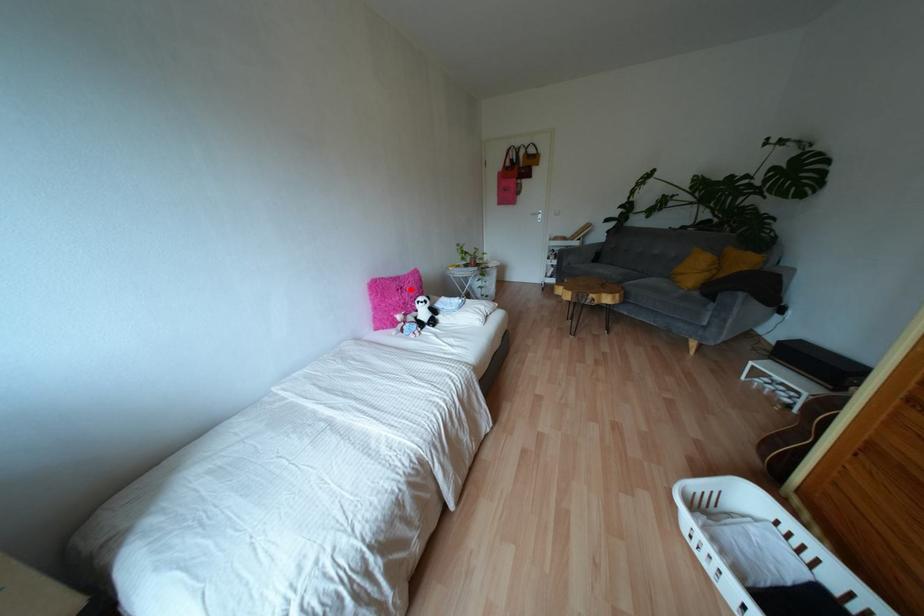
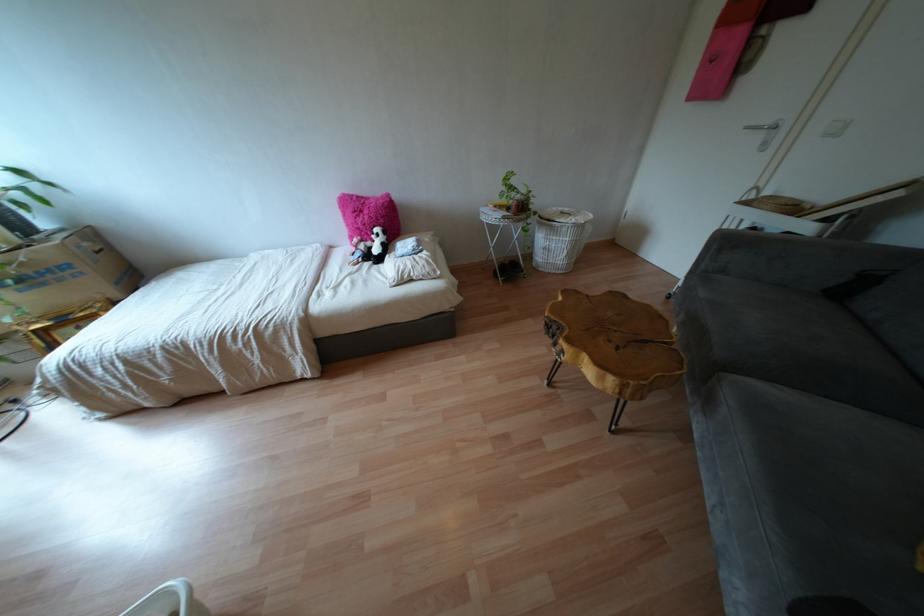
Find the pixel in the second image that matches the highlighted location in the first image.

(365, 217)